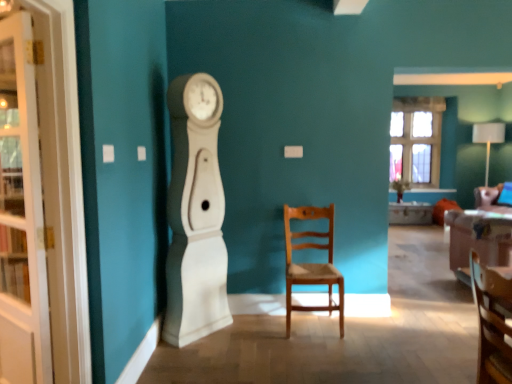
Question: Is white glossy desk at center completely or partially inside white glass cabinet at left?

Choices:
 (A) yes
 (B) no

Answer: (B)

Question: Is white glass cabinet at left at the left side of white glossy desk at center?

Choices:
 (A) no
 (B) yes

Answer: (B)

Question: Is white glass cabinet at left to the right of white glossy desk at center from the viewer's perspective?

Choices:
 (A) no
 (B) yes

Answer: (A)

Question: Is white glass cabinet at left oriented towards white glossy desk at center?

Choices:
 (A) no
 (B) yes

Answer: (A)

Question: From a real-world perspective, is white glass cabinet at left located beneath white glossy desk at center?

Choices:
 (A) yes
 (B) no

Answer: (B)

Question: Can you confirm if white glass cabinet at left is thinner than white glossy desk at center?

Choices:
 (A) no
 (B) yes

Answer: (B)

Question: From the image's perspective, is wooden chair at lower right, positioned as the first chair in right-to-left order, above white glossy desk at center?

Choices:
 (A) yes
 (B) no

Answer: (B)

Question: Does wooden chair at lower right, which is the 1th chair from front to back, have a larger size compared to white glossy desk at center?

Choices:
 (A) no
 (B) yes

Answer: (A)

Question: Is wooden chair at lower right, which is the 1th chair from front to back, to the left of white glossy desk at center from the viewer's perspective?

Choices:
 (A) no
 (B) yes

Answer: (B)

Question: From a real-world perspective, does wooden chair at lower right, which is the 1th chair from front to back, stand above white glossy desk at center?

Choices:
 (A) no
 (B) yes

Answer: (B)

Question: Is wooden chair at lower right, which is the 1th chair from front to back, thinner than white glossy desk at center?

Choices:
 (A) yes
 (B) no

Answer: (A)

Question: Is wooden chair at lower right, positioned as the first chair in right-to-left order, positioned in front of white glossy desk at center?

Choices:
 (A) no
 (B) yes

Answer: (B)

Question: Are clear glass window at upper right and wooden chair at center, marked as the first chair in a left-to-right arrangement, beside each other?

Choices:
 (A) yes
 (B) no

Answer: (B)